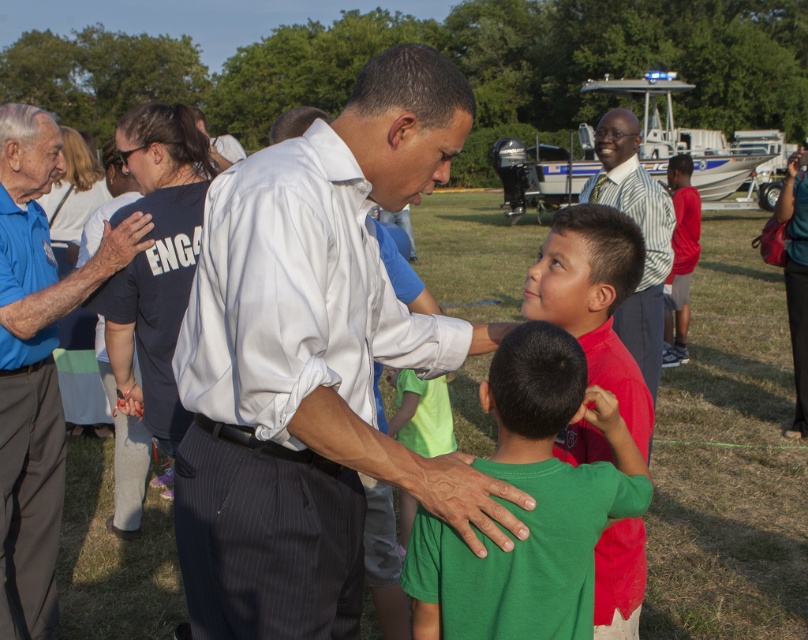
Which of these two, matte green shirt at center or striped shirt at center, stands shorter?

striped shirt at center is shorter.

Does matte green shirt at center lie in front of striped shirt at center?

Yes, it is.

What do you see at coordinates (592, 300) in the screenshot? I see `matte green shirt at center` at bounding box center [592, 300].

At what (x,y) coordinates should I click in order to perform the action: click on matte green shirt at center. Please return your answer as a coordinate pair (x, y). Image resolution: width=808 pixels, height=640 pixels. Looking at the image, I should click on (592, 300).

Which of these two, white pinstripe shirt at center or blue shirt at left, stands taller?

Standing taller between the two is blue shirt at left.

Consider the image. Who is lower down, white pinstripe shirt at center or blue shirt at left?

Positioned lower is blue shirt at left.

The width and height of the screenshot is (808, 640). I want to click on white pinstripe shirt at center, so click(x=316, y=364).

Identify the location of white pinstripe shirt at center. This screenshot has width=808, height=640. (316, 364).

Between white pinstripe shirt at center and red matte shirt at right, which one is positioned lower?

Positioned lower is white pinstripe shirt at center.

The width and height of the screenshot is (808, 640). What do you see at coordinates (316, 364) in the screenshot? I see `white pinstripe shirt at center` at bounding box center [316, 364].

Which is behind, point (503, 506) or point (680, 253)?

The point (680, 253) is behind.

Locate an element on the screen. This screenshot has height=640, width=808. white pinstripe shirt at center is located at coordinates (316, 364).